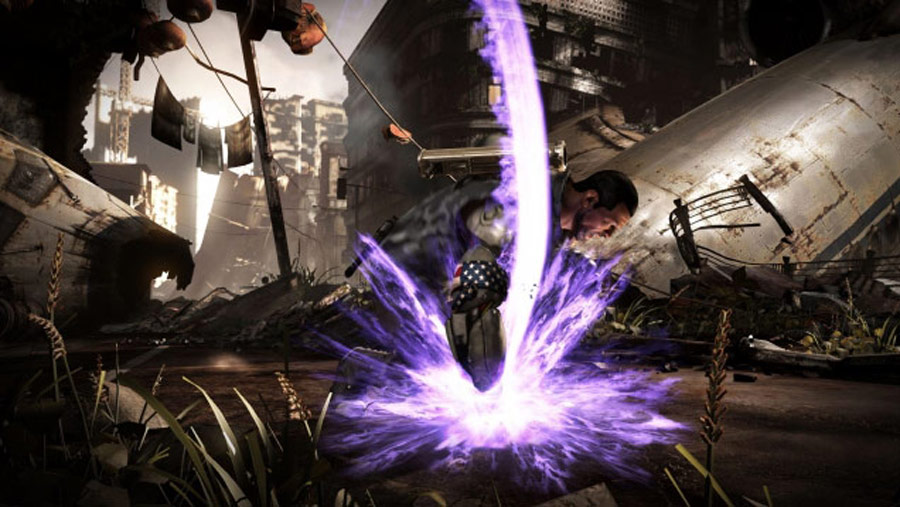
Locate an element on the screen. The image size is (900, 507). gray surface floor is located at coordinates (806, 429).